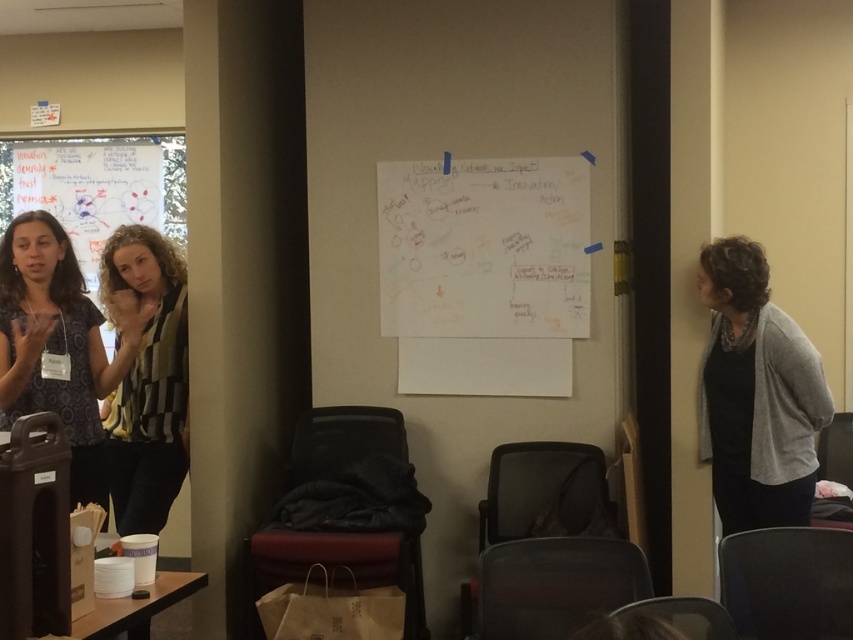
You are standing at the entrance of the meeting room and want to sit in the dark fabric chair at lower center. Based on the coordinates provided, can you estimate how far you need to walk from the entrance to reach the chair?

The dark fabric chair at lower center is located at coordinates point (335, 561), which means it is positioned approximately 87.7 cm from the left edge and 39.5 cm from the bottom edge of the room. To reach it from the entrance, you would need to walk towards the lower center area of the room, but the exact distance depends on your starting position at the entrance.